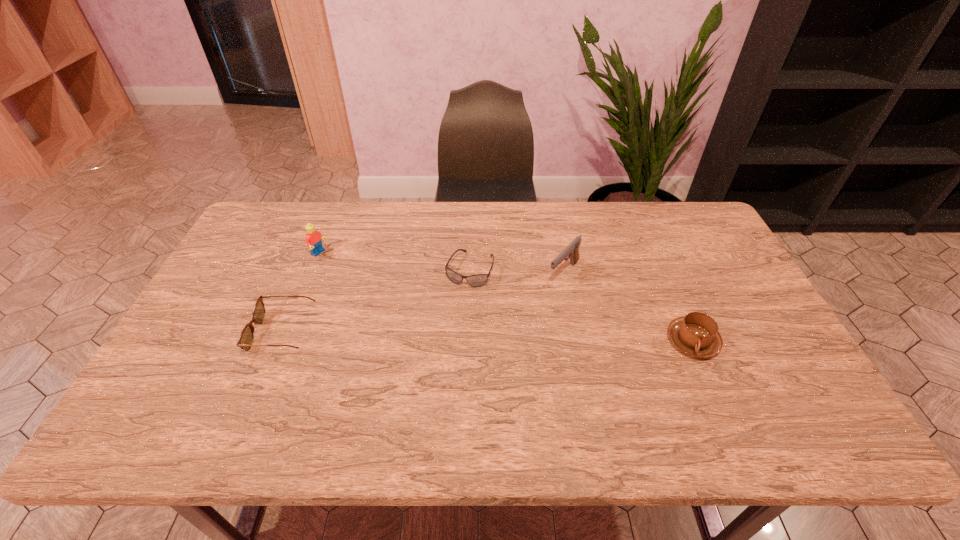
In the image, there is a desktop. Where is `vacant space at the left edge`? Image resolution: width=960 pixels, height=540 pixels. vacant space at the left edge is located at coordinates (255, 252).

Locate an element on the screen. This screenshot has width=960, height=540. vacant area at the right edge of the desktop is located at coordinates (739, 272).

In the image, there is a desktop. Where is `blank space at the far left corner`? The height and width of the screenshot is (540, 960). blank space at the far left corner is located at coordinates (292, 212).

What are the coordinates of `free space between the Lego and the sunglasses` in the screenshot? It's located at (395, 261).

This screenshot has height=540, width=960. What are the coordinates of `empty location between the rightmost object and the pistol` in the screenshot? It's located at (628, 307).

Identify the location of vacant space that's between the spectacles and the second object from right to left. This screenshot has width=960, height=540. (424, 303).

Where is `free space that is in between the rightmost object and the shortest object`? The image size is (960, 540). free space that is in between the rightmost object and the shortest object is located at coordinates (581, 305).

The height and width of the screenshot is (540, 960). Find the location of `vacant space in between the spectacles and the pistol`. vacant space in between the spectacles and the pistol is located at coordinates (424, 303).

Find the location of a particular element. This screenshot has width=960, height=540. unoccupied position between the spectacles and the Lego is located at coordinates (301, 293).

Identify the location of empty location between the cappuccino and the shortest object. Image resolution: width=960 pixels, height=540 pixels. (581, 305).